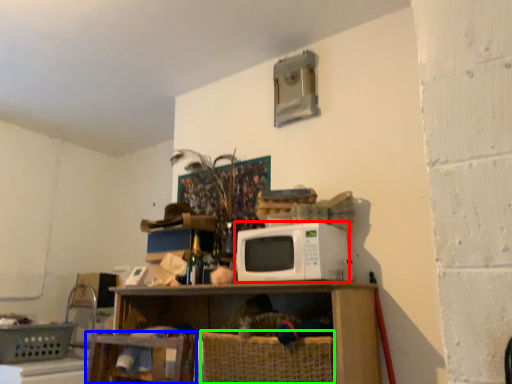
Question: Based on their relative distances, which object is nearer to microwave oven (highlighted by a red box)? Choose from swivel chair (highlighted by a blue box) and basket (highlighted by a green box).

Choices:
 (A) swivel chair
 (B) basket

Answer: (B)